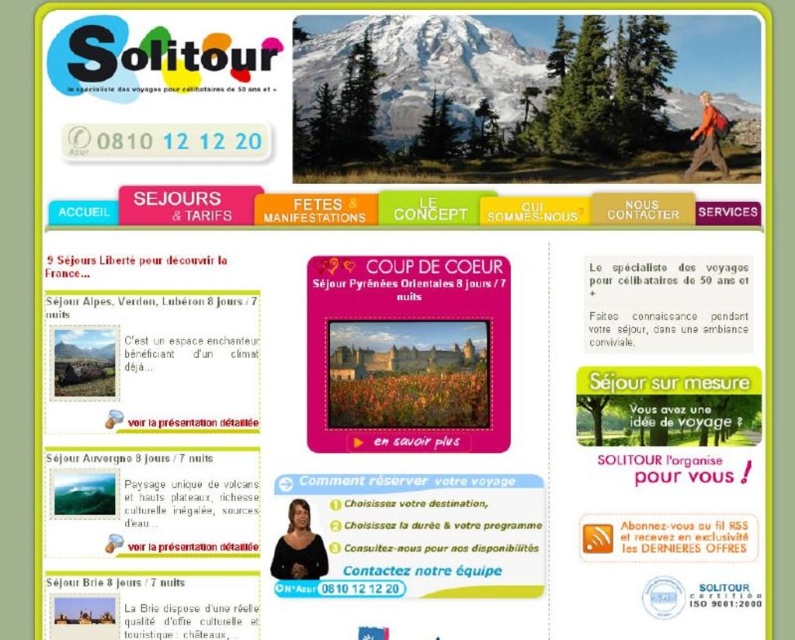
Who is higher up, matte orange backpack at upper right or matte pink button at center?

Positioned higher is matte orange backpack at upper right.

Is matte orange backpack at upper right further to camera compared to matte pink button at center?

Yes, matte orange backpack at upper right is behind matte pink button at center.

Does point (708, 147) come farther from viewer compared to point (165, 548)?

That is True.

This screenshot has width=795, height=640. I want to click on matte orange backpack at upper right, so click(x=708, y=138).

Who is higher up, matte black woman at bottom center or matte orange backpack at upper right?

matte orange backpack at upper right

Where is `matte black woman at bottom center`? This screenshot has height=640, width=795. matte black woman at bottom center is located at coordinates (297, 547).

Is point (281, 541) farther from viewer compared to point (718, 170)?

No.

Where is `matte black woman at bottom center`? matte black woman at bottom center is located at coordinates (297, 547).

Does matte black woman at bottom center appear over matte pink button at center?

Yes, matte black woman at bottom center is above matte pink button at center.

Who is lower down, matte black woman at bottom center or matte pink button at center?

matte pink button at center is below.

Is point (311, 573) farther from viewer compared to point (177, 545)?

That is False.

Where is `matte black woman at bottom center`? matte black woman at bottom center is located at coordinates (297, 547).